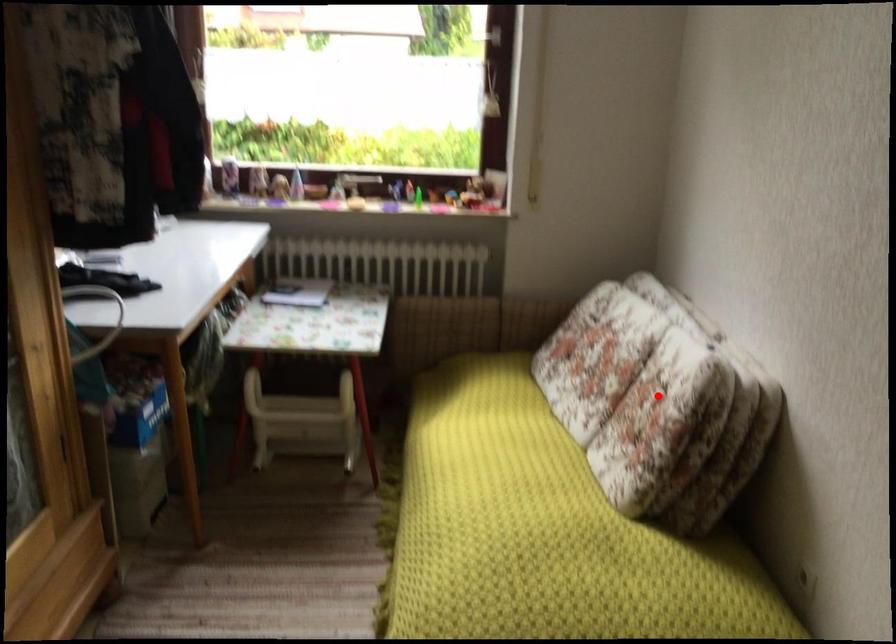
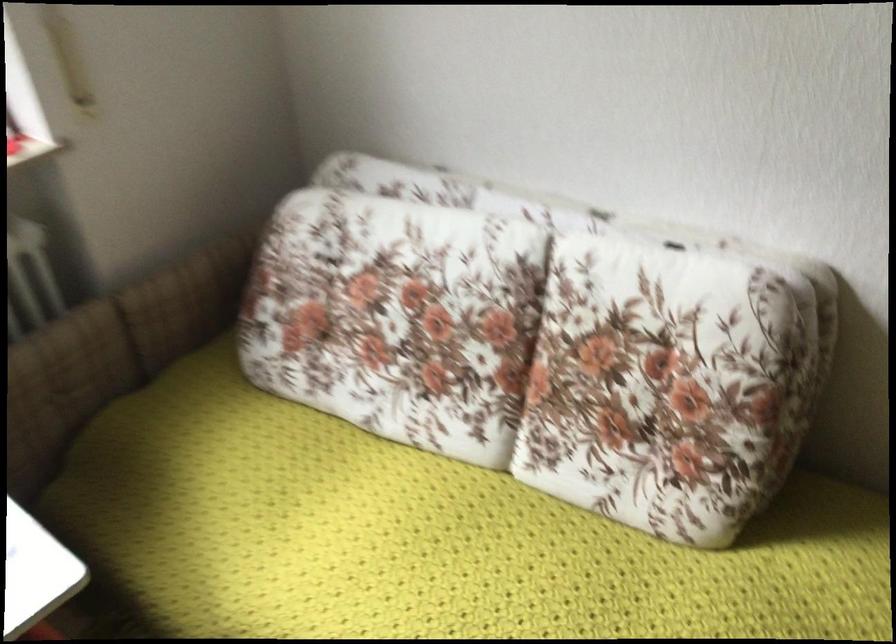
Question: I am providing you with two images of the same scene from different viewpoints. In image1, a red point is highlighted. Considering the same 3D point in image2, which of the following is correct?

Choices:
 (A) It is closer
 (B) It is farther

Answer: (A)